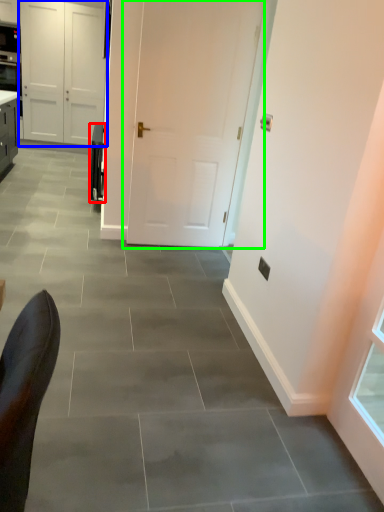
Question: Based on their relative distances, which object is farther from appliance (highlighted by a red box)? Choose from door (highlighted by a blue box) and door (highlighted by a green box).

Choices:
 (A) door
 (B) door

Answer: (A)